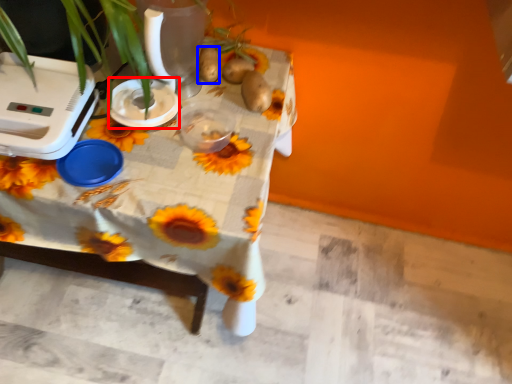
Question: Which object appears closest to the camera in this image, appliance (highlighted by a red box) or potato (highlighted by a blue box)?

Choices:
 (A) appliance
 (B) potato

Answer: (A)